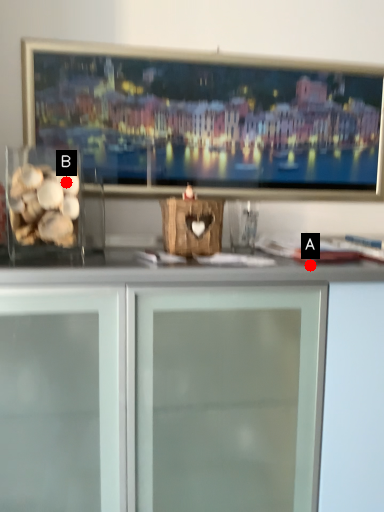
Question: Two points are circled on the image, labeled by A and B beside each circle. Which point is closer to the camera?

Choices:
 (A) A is closer
 (B) B is closer

Answer: (A)